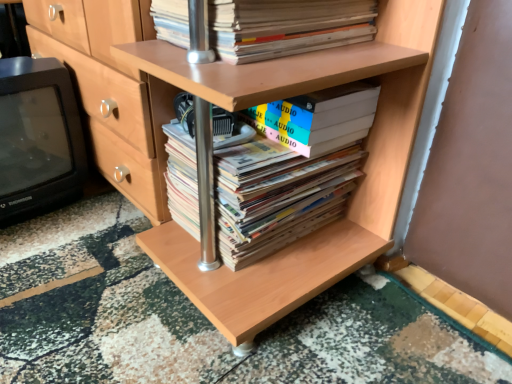
At what (x,y) coordinates should I click in order to perform the action: click on vacant area that is in front of black plastic television at left. Please return your answer as a coordinate pair (x, y). Image resolution: width=512 pixels, height=384 pixels. Looking at the image, I should click on (46, 249).